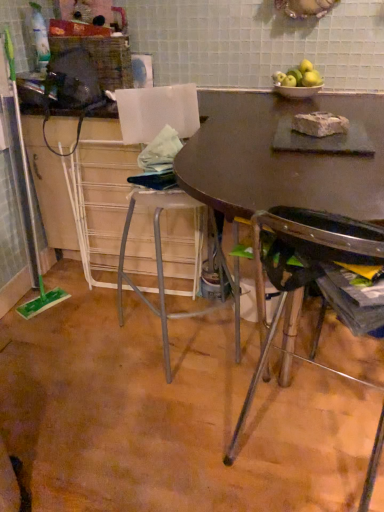
Find the location of `green matte apples at upper right`. green matte apples at upper right is located at coordinates (299, 76).

What do you see at coordinates (300, 270) in the screenshot? This screenshot has height=512, width=384. I see `metallic silver chair at lower right` at bounding box center [300, 270].

Where is `matte brown table at upper center`? This screenshot has width=384, height=512. matte brown table at upper center is located at coordinates click(280, 157).

Locate an element on the screen. green matte apples at upper right is located at coordinates (299, 76).

Consider the image. Looking at the image, does green matte apples at upper right seem bigger or smaller compared to matte brown table at upper center?

green matte apples at upper right is smaller than matte brown table at upper center.

Could matte brown table at upper center be considered to be inside green matte apples at upper right?

No.

Is green matte apples at upper right aimed at matte brown table at upper center?

No, green matte apples at upper right is not aimed at matte brown table at upper center.

Is green matte apples at upper right taller than matte brown table at upper center?

In fact, green matte apples at upper right may be shorter than matte brown table at upper center.

Is green matte apples at upper right outside of matte brown table at center?

green matte apples at upper right lies outside matte brown table at center's area.

Can you confirm if green matte apples at upper right is shorter than matte brown table at center?

Correct, green matte apples at upper right is not as tall as matte brown table at center.

Considering the points (281, 84) and (239, 160), which point is behind, point (281, 84) or point (239, 160)?

Point (281, 84)

Is green matte apples at upper right oriented away from matte brown table at center?

No, matte brown table at center is not at the back of green matte apples at upper right.

From a real-world perspective, between metallic silver chair at lower right and green matte apples at upper right, who is vertically higher?

green matte apples at upper right.

Is metallic silver chair at lower right not inside green matte apples at upper right?

Yes, metallic silver chair at lower right is outside of green matte apples at upper right.

Does metallic silver chair at lower right have a lesser height compared to green matte apples at upper right?

No, metallic silver chair at lower right is not shorter than green matte apples at upper right.

Can you confirm if metallic silver chair at lower right is wider than green matte apples at upper right?

Correct, the width of metallic silver chair at lower right exceeds that of green matte apples at upper right.

Is matte brown table at center located outside matte brown table at upper center?

matte brown table at center is positioned outside matte brown table at upper center.

Is matte brown table at center wider or thinner than matte brown table at upper center?

In the image, matte brown table at center appears to be wider than matte brown table at upper center.

Which is in front, point (326, 163) or point (250, 211)?

The point (250, 211) is closer.

Can you tell me how much matte brown table at center and matte brown table at upper center differ in facing direction?

The angle between the facing direction of matte brown table at center and the facing direction of matte brown table at upper center is 0.000395 degrees.

Considering the relative sizes of green matte apples at upper right and metallic silver chair at lower right in the image provided, is green matte apples at upper right shorter than metallic silver chair at lower right?

Indeed, green matte apples at upper right has a lesser height compared to metallic silver chair at lower right.

Considering the relative positions of green matte apples at upper right and metallic silver chair at lower right in the image provided, is green matte apples at upper right to the left or to the right of metallic silver chair at lower right?

In the image, green matte apples at upper right appears on the right side of metallic silver chair at lower right.

Is green matte apples at upper right oriented away from metallic silver chair at lower right?

green matte apples at upper right is not turned away from metallic silver chair at lower right.

From the image's perspective, is green matte apples at upper right below metallic silver chair at lower right?

No, from the image's perspective, green matte apples at upper right is not beneath metallic silver chair at lower right.

How far apart are matte brown table at upper center and matte brown table at center?

matte brown table at upper center is 0.52 inches away from matte brown table at center.

Would you consider matte brown table at upper center to be distant from matte brown table at center?

That's not correct — matte brown table at upper center is a little close to matte brown table at center.

Is matte brown table at center surrounded by matte brown table at upper center?

Definitely not — matte brown table at center is not inside matte brown table at upper center.

Is green matte apples at upper right surrounded by matte brown table at center?

That's incorrect, green matte apples at upper right is not inside matte brown table at center.

From the picture: Is there a large distance between matte brown table at center and green matte apples at upper right?

No, matte brown table at center is in close proximity to green matte apples at upper right.

From a real-world perspective, who is located higher, matte brown table at center or green matte apples at upper right?

From a 3D spatial view, green matte apples at upper right is above.

Which point is more forward, (253, 104) or (309, 78)?

Positioned in front is point (253, 104).

Where is `counter top below the green matte apples at upper right (from the image's perspective)`? counter top below the green matte apples at upper right (from the image's perspective) is located at coordinates (280, 157).

The height and width of the screenshot is (512, 384). I want to click on table on the left of green matte apples at upper right, so click(280, 158).

Looking at this image, estimate the real-world distances between objects in this image. Which object is closer to matte brown table at upper center, matte brown table at center or green matte apples at upper right?

The object closer to matte brown table at upper center is matte brown table at center.

When comparing their distances from metallic silver chair at lower right, does matte brown table at upper center or green matte apples at upper right seem further?

Based on the image, green matte apples at upper right appears to be further to metallic silver chair at lower right.

Considering their positions, is metallic silver chair at lower right positioned further to green matte apples at upper right than matte brown table at center?

metallic silver chair at lower right is further to green matte apples at upper right.

Which object lies further to the anchor point matte brown table at center, matte brown table at upper center or green matte apples at upper right?

green matte apples at upper right is positioned further to the anchor matte brown table at center.

Based on their spatial positions, is green matte apples at upper right or matte brown table at center further from matte brown table at upper center?

Among the two, green matte apples at upper right is located further to matte brown table at upper center.

Estimate the real-world distances between objects in this image. Which object is further from matte brown table at center, metallic silver chair at lower right or green matte apples at upper right?

metallic silver chair at lower right is further to matte brown table at center.

Looking at the image, which one is located further to matte brown table at upper center, metallic silver chair at lower right or green matte apples at upper right?

metallic silver chair at lower right lies further to matte brown table at upper center than the other object.

Looking at the image, which one is located closer to matte brown table at center, green matte apples at upper right or metallic silver chair at lower right?

Based on the image, green matte apples at upper right appears to be nearer to matte brown table at center.

You are a GUI agent. You are given a task and a screenshot of the screen. Output one action in this format:
    pyautogui.click(x=<x>, y=<y>)
    Task: Click on the table between metallic silver chair at lower right and green matte apples at upper right along the z-axis
    
    Given the screenshot: What is the action you would take?
    pyautogui.click(x=280, y=158)

The image size is (384, 512). Find the location of `counter top between matte brown table at center and green matte apples at upper right along the z-axis`. counter top between matte brown table at center and green matte apples at upper right along the z-axis is located at coordinates (280, 157).

Identify the location of table between metallic silver chair at lower right and matte brown table at upper center from front to back. (280, 158).

Find the location of `counter top between metallic silver chair at lower right and green matte apples at upper right along the z-axis`. counter top between metallic silver chair at lower right and green matte apples at upper right along the z-axis is located at coordinates (280, 157).